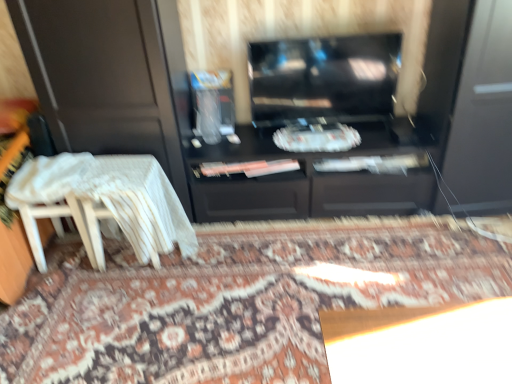
Question: Should I look upward or downward to see white lace table at lower left?

Choices:
 (A) up
 (B) down

Answer: (B)

Question: Could you tell me if white lace table at lower left is facing clear plastic container at center?

Choices:
 (A) yes
 (B) no

Answer: (B)

Question: Does white lace table at lower left have a lesser width compared to clear plastic container at center?

Choices:
 (A) no
 (B) yes

Answer: (A)

Question: Can you confirm if white lace table at lower left is wider than clear plastic container at center?

Choices:
 (A) no
 (B) yes

Answer: (B)

Question: Is white lace table at lower left far away from clear plastic container at center?

Choices:
 (A) no
 (B) yes

Answer: (A)

Question: From a real-world perspective, is white lace table at lower left physically below clear plastic container at center?

Choices:
 (A) yes
 (B) no

Answer: (A)

Question: Does white lace table at lower left have a greater height compared to clear plastic container at center?

Choices:
 (A) no
 (B) yes

Answer: (B)

Question: Is patterned carpet at center positioned far away from glossy black tv at center?

Choices:
 (A) no
 (B) yes

Answer: (A)

Question: From a real-world perspective, is patterned carpet at center on glossy black tv at center?

Choices:
 (A) yes
 (B) no

Answer: (B)

Question: From the image's perspective, is patterned carpet at center over glossy black tv at center?

Choices:
 (A) no
 (B) yes

Answer: (A)

Question: Is patterned carpet at center smaller than glossy black tv at center?

Choices:
 (A) yes
 (B) no

Answer: (B)

Question: Does patterned carpet at center have a lesser width compared to glossy black tv at center?

Choices:
 (A) yes
 (B) no

Answer: (B)

Question: Does patterned carpet at center come behind glossy black tv at center?

Choices:
 (A) yes
 (B) no

Answer: (B)

Question: Is white wood chair at left to the left of clear plastic container at center from the viewer's perspective?

Choices:
 (A) no
 (B) yes

Answer: (B)